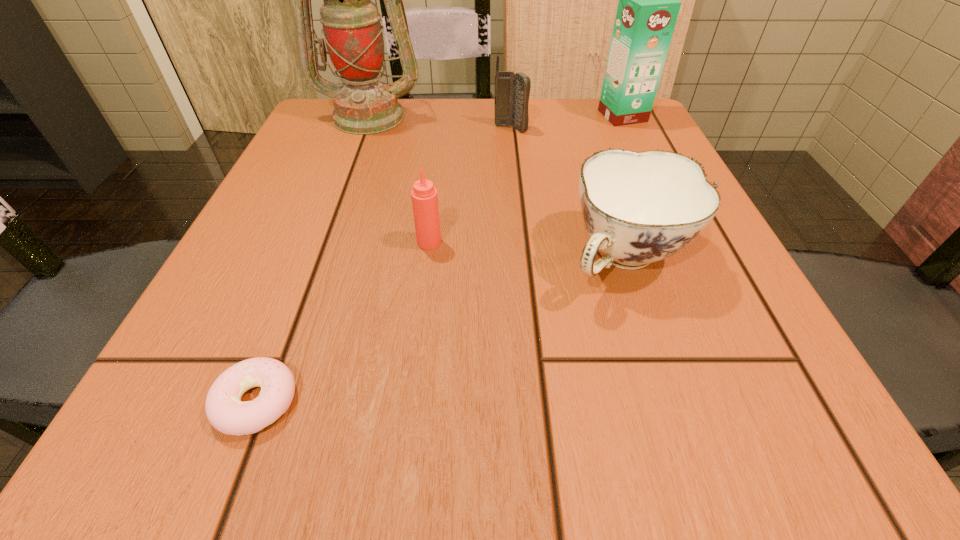
Identify the location of unoccupied position between the nearest object and the fourth object from right to left. (343, 322).

Locate an element on the screen. Image resolution: width=960 pixels, height=540 pixels. vacant space in between the fourth object from right to left and the tallest object is located at coordinates (399, 179).

The height and width of the screenshot is (540, 960). What are the coordinates of `unoccupied position between the chinaware and the oil lamp` in the screenshot? It's located at (497, 187).

Find the location of `vacant space in between the chinaware and the doughnut`. vacant space in between the chinaware and the doughnut is located at coordinates (441, 329).

The image size is (960, 540). I want to click on free spot between the chinaware and the Tabasco sauce, so click(x=527, y=250).

I want to click on free space between the tallest object and the Tabasco sauce, so click(399, 179).

What are the coordinates of `free point between the second tallest object and the shortest object` in the screenshot? It's located at (440, 259).

Image resolution: width=960 pixels, height=540 pixels. What are the coordinates of `vacant area that lies between the oil lamp and the third object from left to right` in the screenshot? It's located at (399, 179).

At what (x,y) coordinates should I click in order to perform the action: click on free space between the fourth object from left to right and the Tabasco sauce. Please return your answer as a coordinate pair (x, y). This screenshot has width=960, height=540. Looking at the image, I should click on (470, 185).

Where is `object that is the fifth closest to the third object from right to left`? Image resolution: width=960 pixels, height=540 pixels. object that is the fifth closest to the third object from right to left is located at coordinates (225, 411).